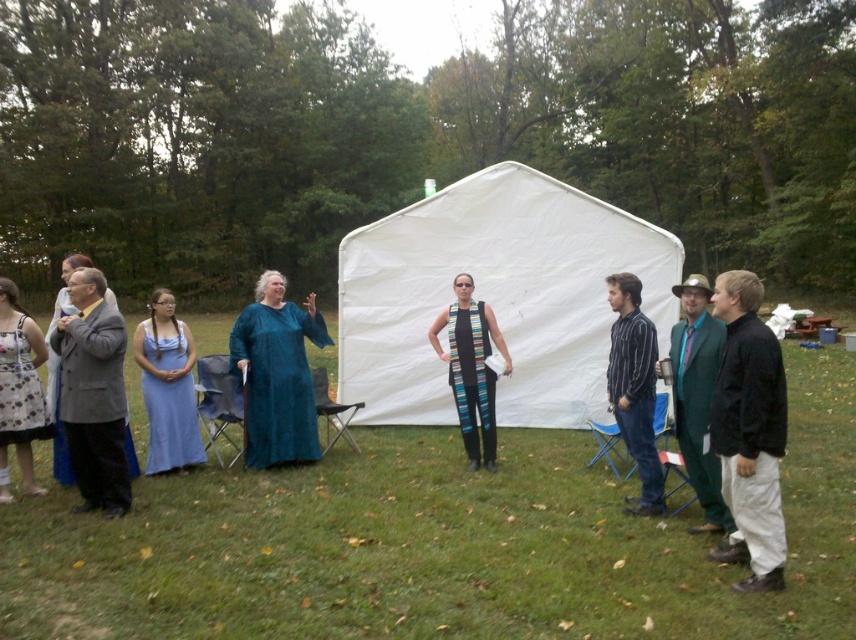
Question: Which object is closer to the camera taking this photo?

Choices:
 (A) floral-patterned dress at left
 (B) striped fabric vest at center
 (C) black matte jacket at lower right

Answer: (C)

Question: Can you confirm if light blue satin dress at left is thinner than striped fabric vest at center?

Choices:
 (A) no
 (B) yes

Answer: (A)

Question: Is teal satin dress at center closer to the viewer compared to striped cotton shirt at center-right?

Choices:
 (A) no
 (B) yes

Answer: (A)

Question: Which is farther from the teal satin dress at center?

Choices:
 (A) white fabric tent at center
 (B) light blue satin dress at left
 (C) green wool suit at right

Answer: (A)

Question: Does gray wool suit at left appear on the left side of striped fabric vest at center?

Choices:
 (A) yes
 (B) no

Answer: (A)

Question: Which of the following is the farthest from the observer?

Choices:
 (A) (629, 424)
 (B) (176, 333)
 (C) (28, 348)
 (D) (712, 525)

Answer: (B)